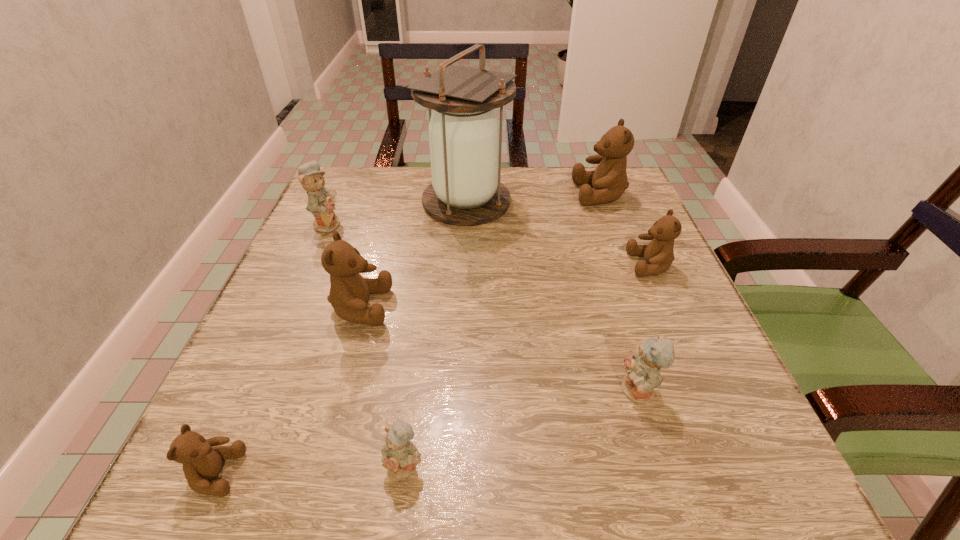
Locate an element on the screen. This screenshot has height=540, width=960. the third farthest teddy bear is located at coordinates (659, 254).

This screenshot has height=540, width=960. What are the coordinates of `the fourth teddy bear from left to right` in the screenshot? It's located at (400, 457).

The height and width of the screenshot is (540, 960). I want to click on the second blue teddy bear from right to left, so click(400, 457).

Locate an element on the screen. The width and height of the screenshot is (960, 540). the nearest brown teddy bear is located at coordinates (202, 462).

Where is `the smallest brown teddy bear`? This screenshot has height=540, width=960. the smallest brown teddy bear is located at coordinates (202, 462).

This screenshot has width=960, height=540. I want to click on vacant space positioned on the front of the lantern, so click(461, 333).

Where is `vacant position located on the front-facing side of the seventh shortest object`? The height and width of the screenshot is (540, 960). vacant position located on the front-facing side of the seventh shortest object is located at coordinates (458, 194).

You are a GUI agent. You are given a task and a screenshot of the screen. Output one action in this format:
    pyautogui.click(x=<x>, y=<y>)
    Task: Click on the vacant region located 0.400m on the front-facing side of the seventh shortest object
    Image resolution: width=960 pixels, height=540 pixels.
    Given the screenshot: What is the action you would take?
    pyautogui.click(x=414, y=194)

Where is `free location located on the front-facing side of the seventh shortest object`? free location located on the front-facing side of the seventh shortest object is located at coordinates (510, 194).

I want to click on free space located 0.070m on the front-facing side of the third object from left to right, so click(428, 307).